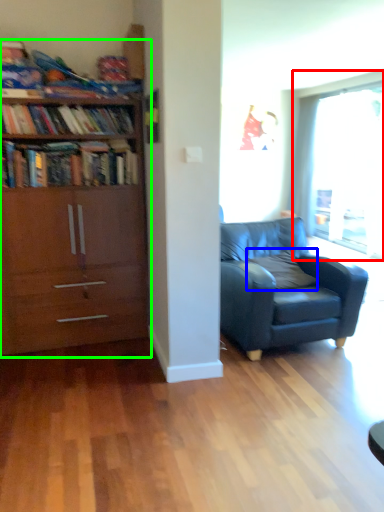
Question: Considering the real-world distances, which object is farthest from window (highlighted by a red box)? pillow (highlighted by a blue box) or bookcase (highlighted by a green box)?

Choices:
 (A) pillow
 (B) bookcase

Answer: (B)